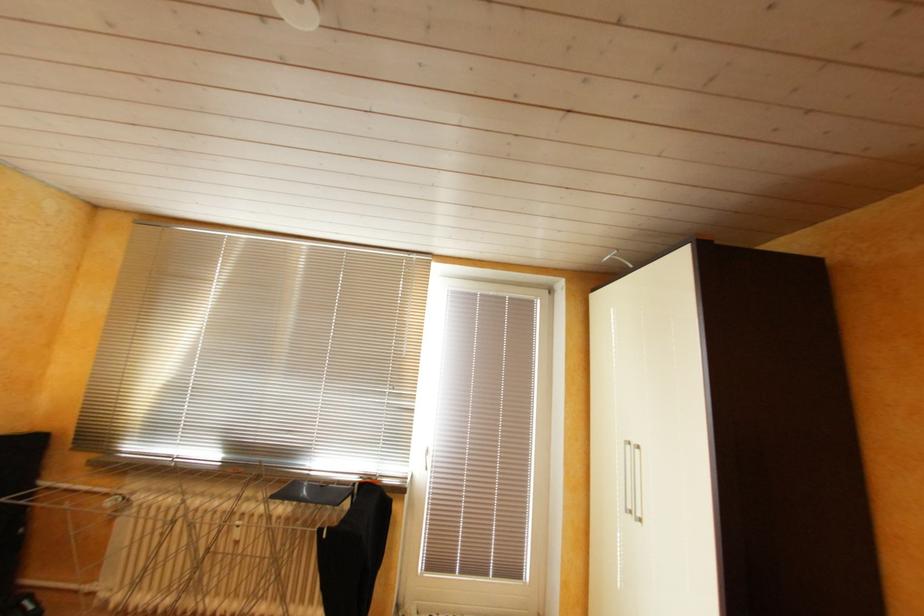
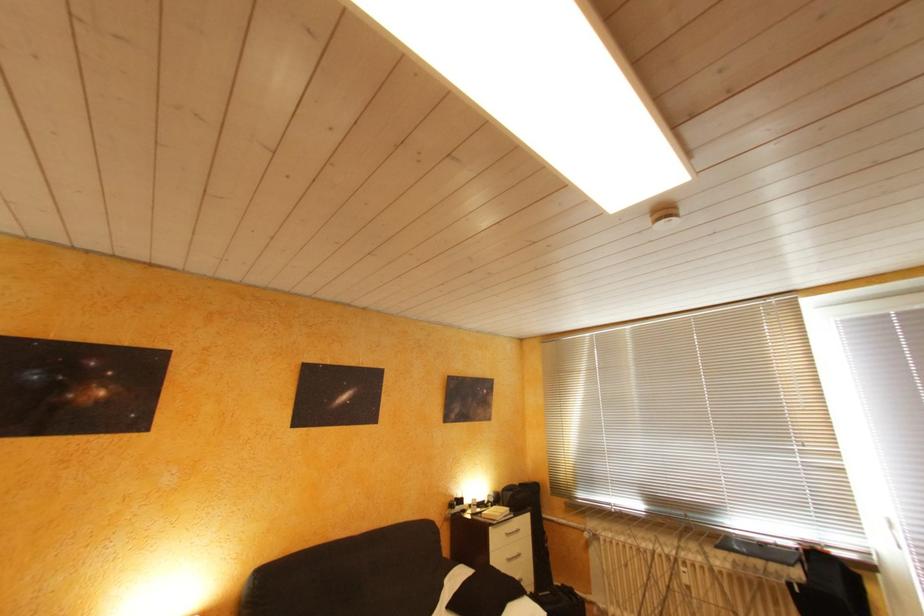
Question: How did the camera likely rotate?

Choices:
 (A) Left
 (B) Right
 (C) Up
 (D) Down

Answer: (A)